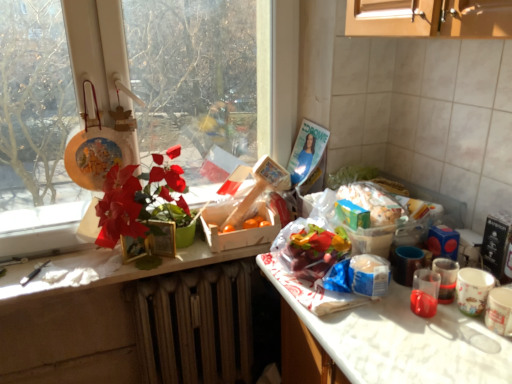
The image size is (512, 384). Find the location of `vacant area on top of smooth wooden counter at center (from a real-world perspective)`. vacant area on top of smooth wooden counter at center (from a real-world perspective) is located at coordinates (121, 259).